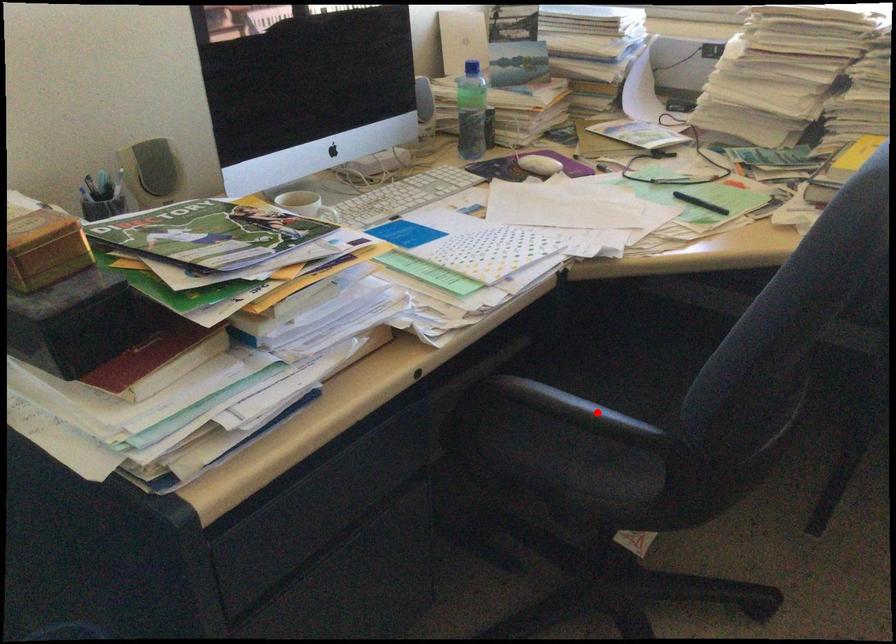
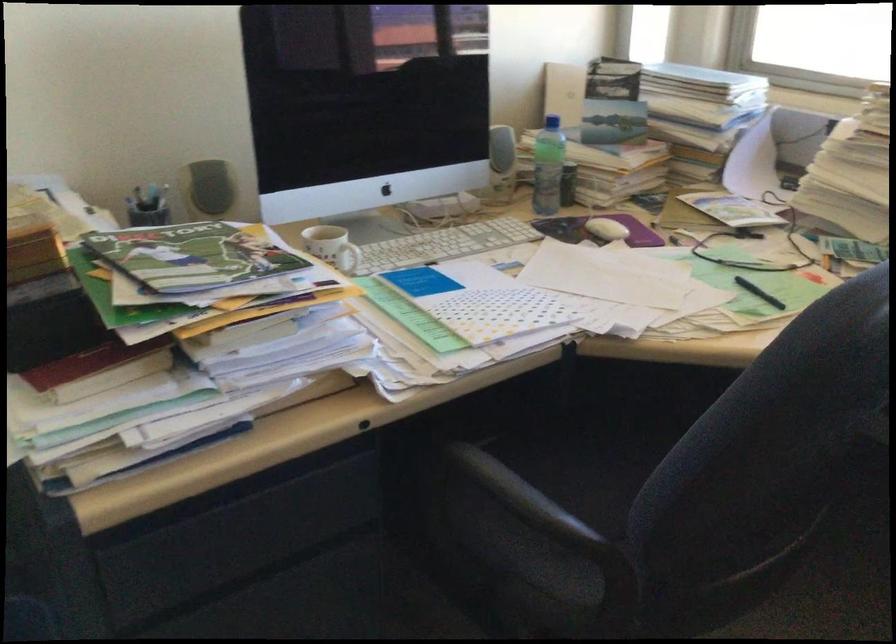
The point at the highlighted location is marked in the first image. Where is the corresponding point in the second image?

(532, 506)